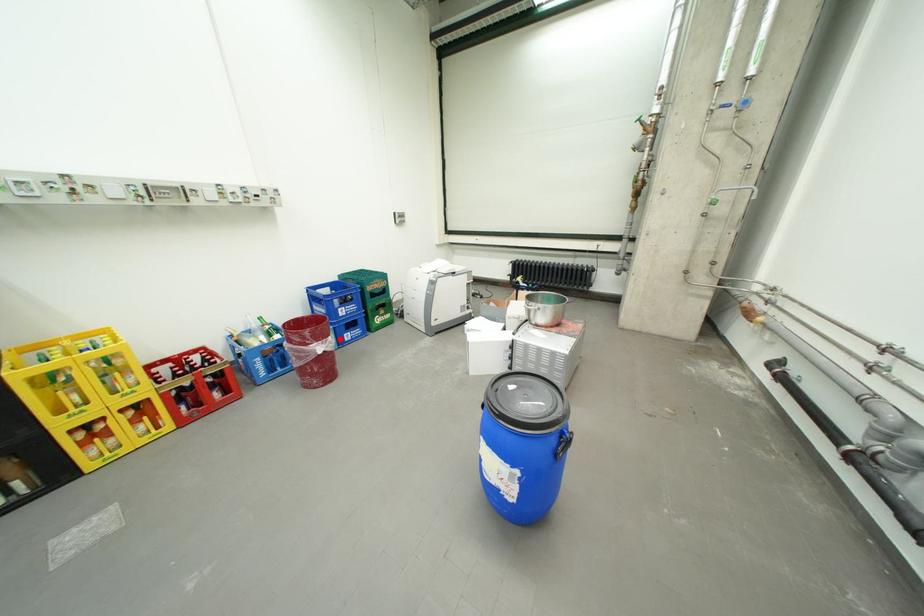
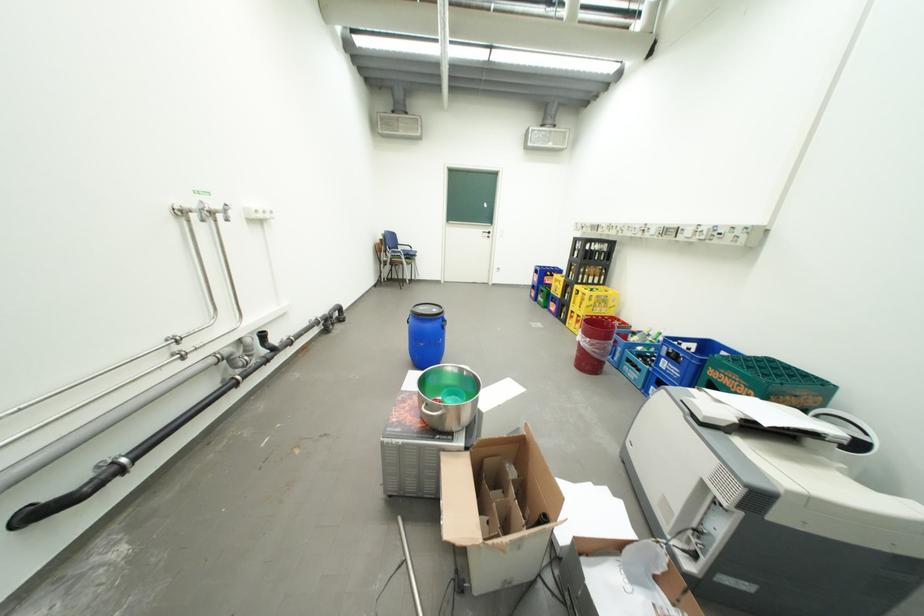
Locate, in the second image, the point that corresponds to the highlighted location in the first image.

(599, 341)